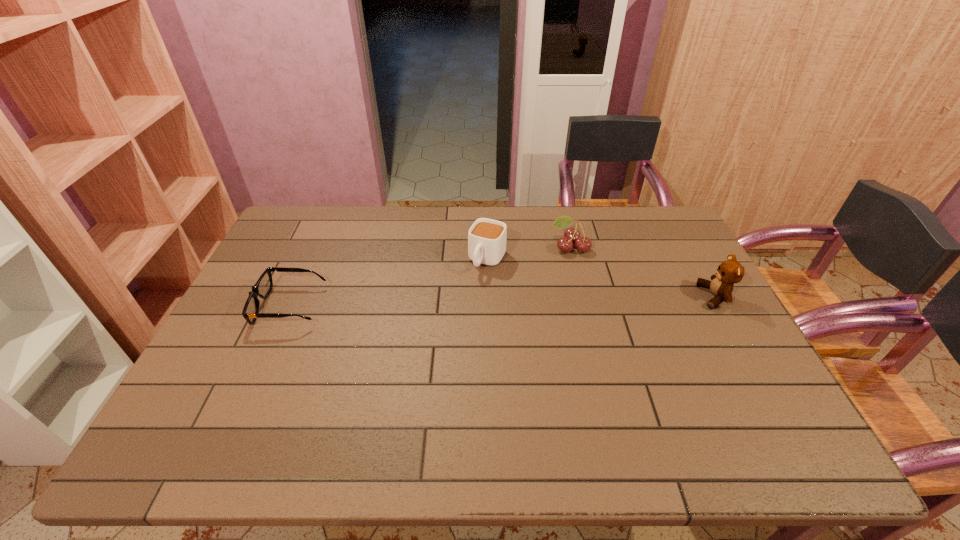
Locate an element on the screen. The width and height of the screenshot is (960, 540). vacant point that satisfies the following two spatial constraints: 1. on the back side of the cup; 2. on the left side of the third object from left to right is located at coordinates (487, 247).

Identify the location of vacant region that satisfies the following two spatial constraints: 1. on the front side of the second object from left to right; 2. on the front-facing side of the teddy bear. (488, 296).